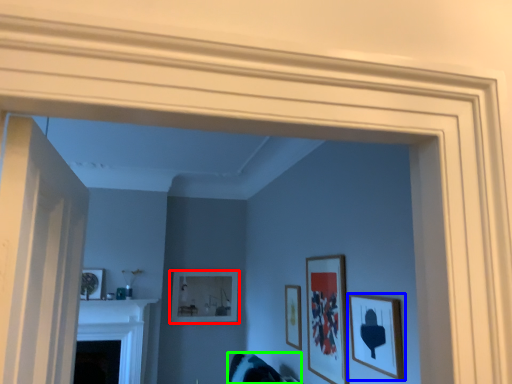
Question: Which is nearer to the picture frame (highlighted by a red box)? picture frame (highlighted by a blue box) or swivel chair (highlighted by a green box).

Choices:
 (A) picture frame
 (B) swivel chair

Answer: (B)